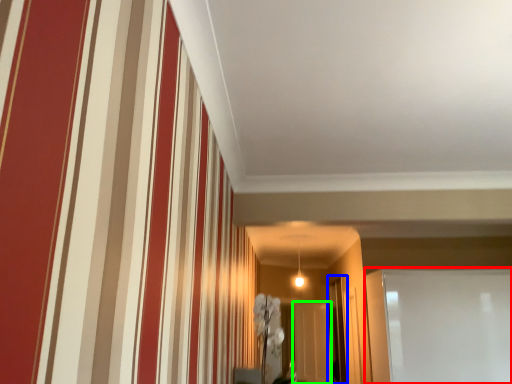
Question: Which is nearer to the glass door (highlighted by a red box)? glass door (highlighted by a blue box) or glass door (highlighted by a green box).

Choices:
 (A) glass door
 (B) glass door

Answer: (A)